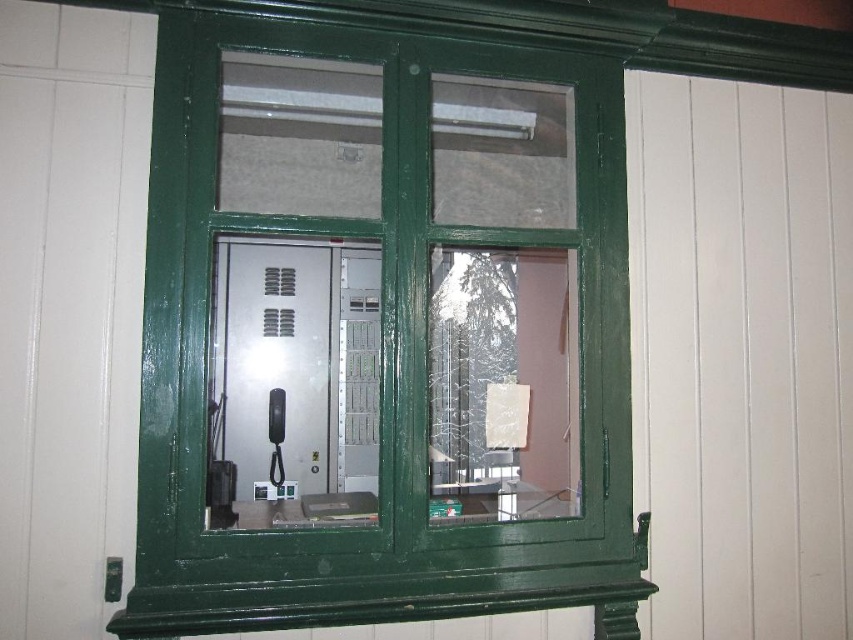
Question: Which point is closer to the camera?

Choices:
 (A) (537, 86)
 (B) (816, 429)

Answer: (A)

Question: Can you confirm if green painted wood at center is bigger than white matte curtain at right?

Choices:
 (A) no
 (B) yes

Answer: (B)

Question: Does green painted wood at center have a lesser width compared to white matte curtain at right?

Choices:
 (A) no
 (B) yes

Answer: (A)

Question: Among these points, which one is nearest to the camera?

Choices:
 (A) (740, 125)
 (B) (387, 262)

Answer: (B)

Question: Can you confirm if green painted wood at center is bigger than white matte curtain at right?

Choices:
 (A) yes
 (B) no

Answer: (A)